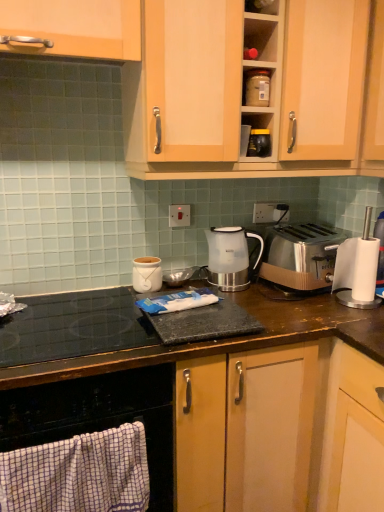
In order to click on free space that is to the left of matte white jar at center, which appears as the 3th kitchen appliance when viewed from the right in this screenshot , I will do `click(100, 294)`.